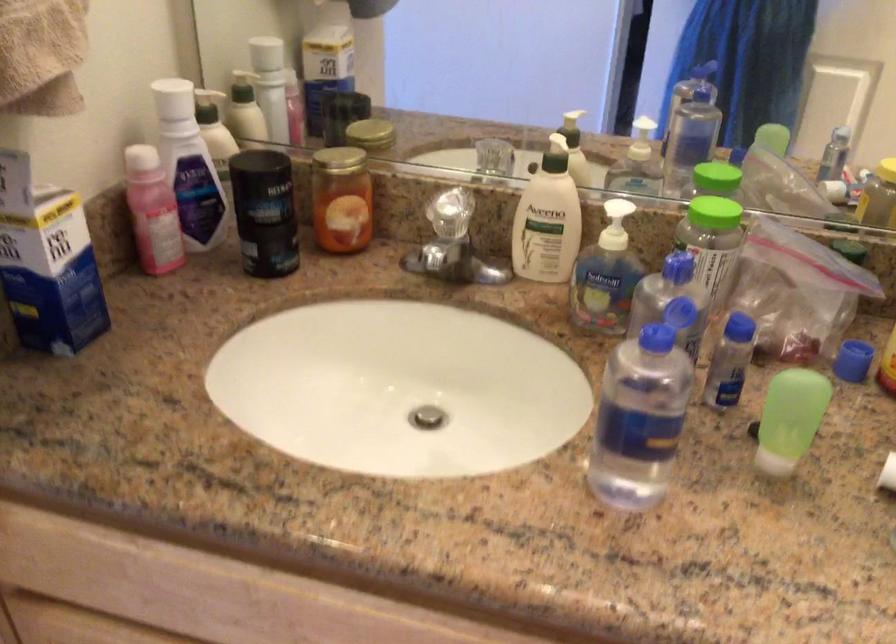
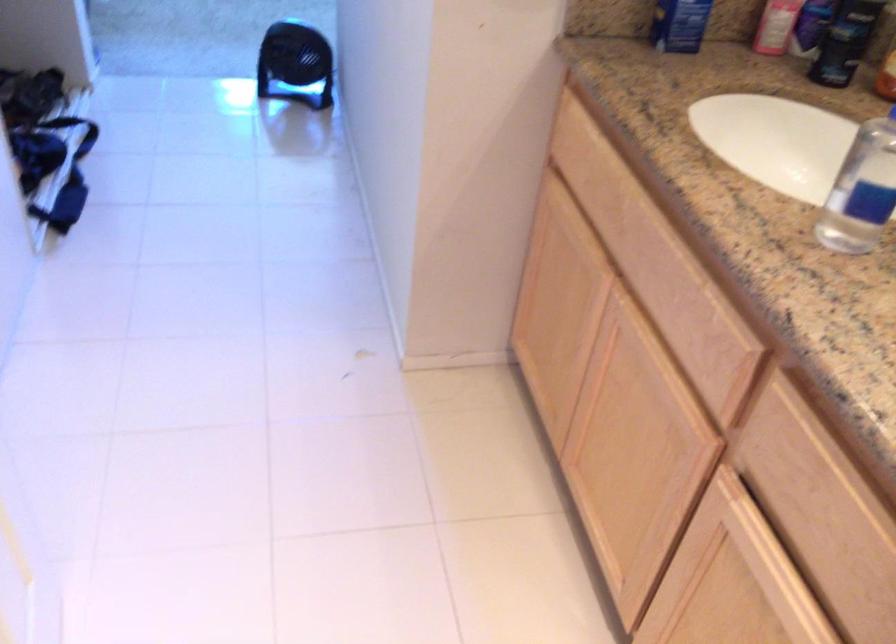
Where in the second image is the point corresponding to pixel 82 303 from the first image?

(679, 24)